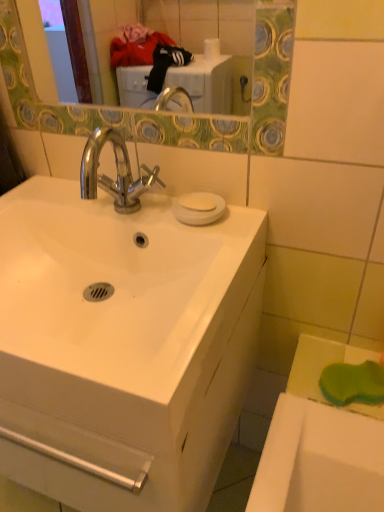
Question: Is white matte soap at upper center to the left of white glossy sink at center from the viewer's perspective?

Choices:
 (A) no
 (B) yes

Answer: (A)

Question: Is white matte soap at upper center taller than white glossy sink at center?

Choices:
 (A) yes
 (B) no

Answer: (B)

Question: Does white matte soap at upper center contain white glossy sink at center?

Choices:
 (A) yes
 (B) no

Answer: (B)

Question: Considering the relative sizes of white matte soap at upper center and white glossy sink at center in the image provided, is white matte soap at upper center thinner than white glossy sink at center?

Choices:
 (A) no
 (B) yes

Answer: (B)

Question: From a real-world perspective, is white matte soap at upper center positioned over white glossy sink at center based on gravity?

Choices:
 (A) no
 (B) yes

Answer: (B)

Question: Is white matte soap at upper center positioned with its back to white glossy sink at center?

Choices:
 (A) no
 (B) yes

Answer: (A)

Question: Considering the relative sizes of white matte soap at upper center and white glossy cabinet at center in the image provided, is white matte soap at upper center wider than white glossy cabinet at center?

Choices:
 (A) yes
 (B) no

Answer: (B)

Question: Is there a large distance between white matte soap at upper center and white glossy cabinet at center?

Choices:
 (A) yes
 (B) no

Answer: (B)

Question: Is white matte soap at upper center touching white glossy cabinet at center?

Choices:
 (A) no
 (B) yes

Answer: (A)

Question: From the image's perspective, is white matte soap at upper center under white glossy cabinet at center?

Choices:
 (A) no
 (B) yes

Answer: (A)

Question: Considering the relative sizes of white matte soap at upper center and white glossy cabinet at center in the image provided, is white matte soap at upper center smaller than white glossy cabinet at center?

Choices:
 (A) yes
 (B) no

Answer: (A)

Question: Does white matte soap at upper center have a greater height compared to white glossy cabinet at center?

Choices:
 (A) no
 (B) yes

Answer: (A)

Question: Would you say white matte soap at upper center is part of white glossy sink at center's contents?

Choices:
 (A) yes
 (B) no

Answer: (B)